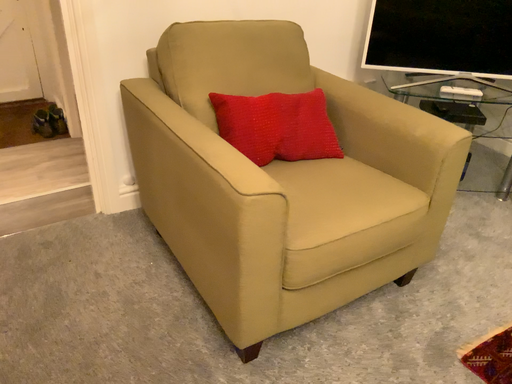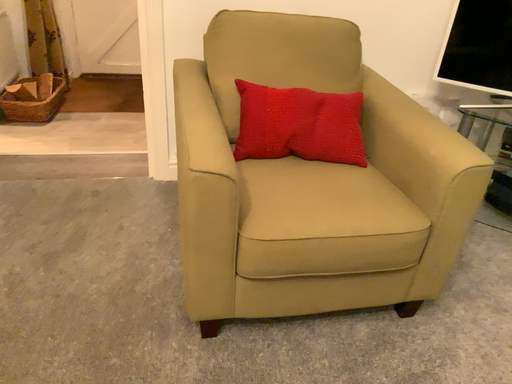
Question: How did the camera likely rotate when shooting the video?

Choices:
 (A) rotated left
 (B) rotated right

Answer: (A)